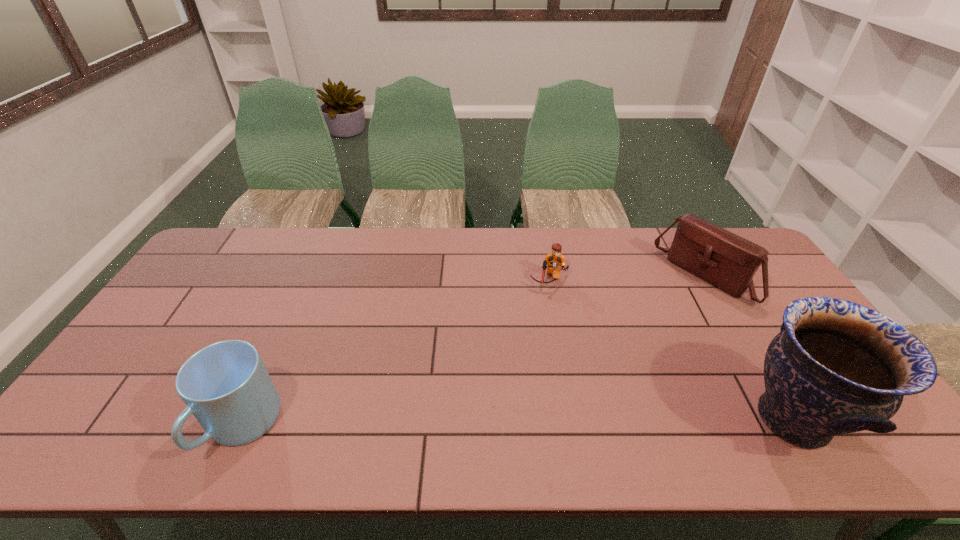
The image size is (960, 540). I want to click on vacant area that lies between the pottery and the shoulder bag, so click(x=748, y=348).

Identify the location of free space between the Lego and the pottery. (671, 350).

Where is `vacant point located between the leftmost object and the Lego`? vacant point located between the leftmost object and the Lego is located at coordinates (396, 353).

Find the location of a particular element. vacant space in between the mug and the shoulder bag is located at coordinates (473, 352).

Identify the location of vacant space that is in between the tallest object and the shortest object. This screenshot has height=540, width=960. (671, 350).

Choose which object is the second nearest neighbor to the second object from left to right. Please provide its 2D coordinates. Your answer should be formatted as a tuple, i.e. [(x, y)], where the tuple contains the x and y coordinates of a point satisfying the conditions above.

[(836, 367)]

You are a GUI agent. You are given a task and a screenshot of the screen. Output one action in this format:
    pyautogui.click(x=<x>, y=<y>)
    Task: Click on the object that is the third closest to the pottery
    
    Given the screenshot: What is the action you would take?
    click(x=226, y=386)

Locate an element on the screen. This screenshot has width=960, height=540. vacant point that satisfies the following two spatial constraints: 1. on the back side of the pottery; 2. on the front handle of the mug is located at coordinates (246, 419).

This screenshot has height=540, width=960. Identify the location of free space that satisfies the following two spatial constraints: 1. on the front side of the pottery; 2. on the front handle of the shoulder bag. (786, 419).

Identify the location of free spot that satisfies the following two spatial constraints: 1. on the front side of the Lego; 2. on the front handle of the tallest object. The image size is (960, 540). (574, 419).